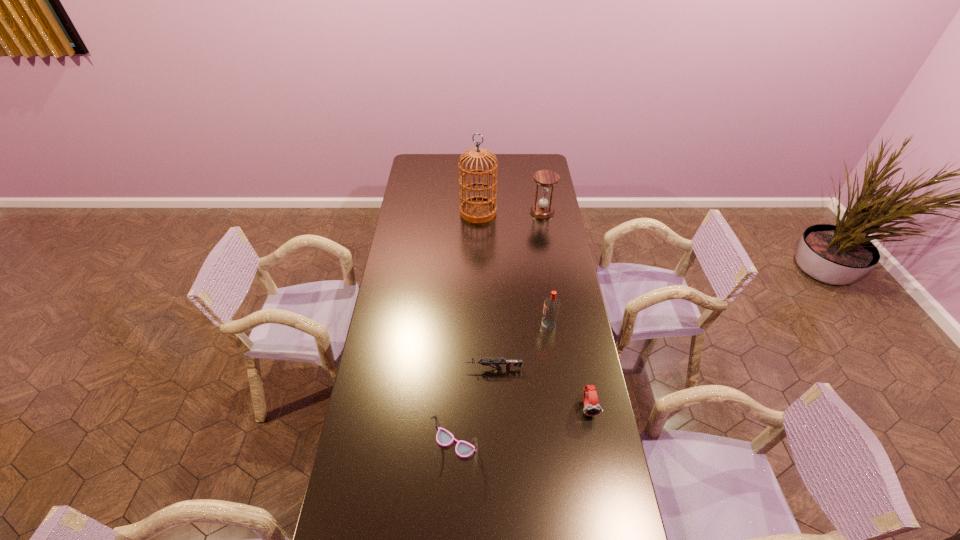
At what (x,y) coordinates should I click in order to perform the action: click on vodka present at the right edge. Please return your answer as a coordinate pair (x, y). This screenshot has width=960, height=540. Looking at the image, I should click on (551, 304).

Locate an element on the screen. Image resolution: width=960 pixels, height=540 pixels. watch at the right edge is located at coordinates (591, 405).

Locate an element on the screen. The height and width of the screenshot is (540, 960). vacant space at the far edge of the desktop is located at coordinates (498, 174).

In the image, there is a desktop. What are the coordinates of `free space at the left edge` in the screenshot? It's located at (361, 520).

In order to click on vacant space at the right edge of the desktop in this screenshot , I will do `click(556, 273)`.

In the image, there is a desktop. In order to click on vacant space at the far right corner in this screenshot , I will do `click(528, 161)`.

The image size is (960, 540). I want to click on free space between the nearest object and the shortest object, so click(x=474, y=406).

Where is `vacant area that lies between the hourglass and the birdcage`? vacant area that lies between the hourglass and the birdcage is located at coordinates (510, 212).

Identify the location of vacant space that's between the fourth tallest object and the fifth tallest object. (521, 425).

Find the location of `free area in between the birdcage and the second nearest object`. free area in between the birdcage and the second nearest object is located at coordinates (534, 309).